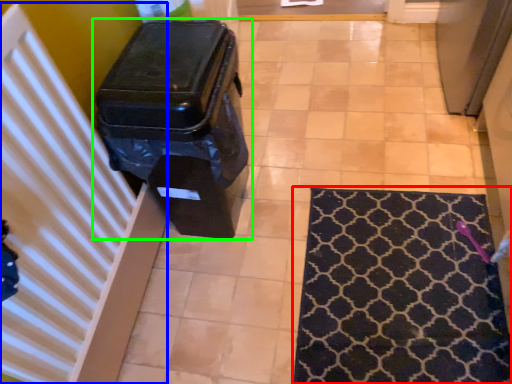
Question: Which object is the closest to the mat (highlighted by a red box)? Choose among these: radiator (highlighted by a blue box) or waste container (highlighted by a green box).

Choices:
 (A) radiator
 (B) waste container

Answer: (B)